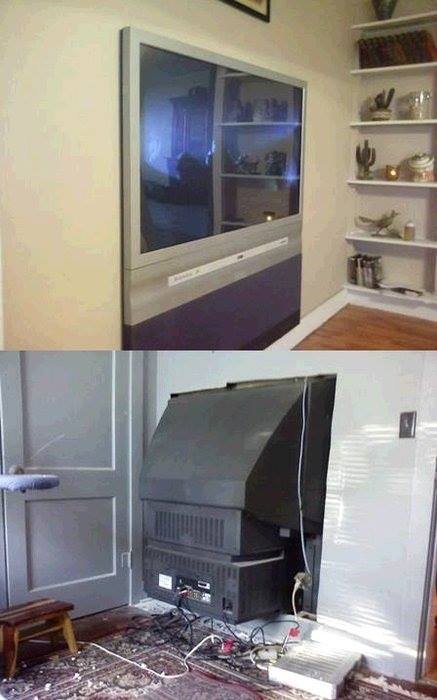
This screenshot has height=700, width=437. I want to click on light switch, so click(x=409, y=426).